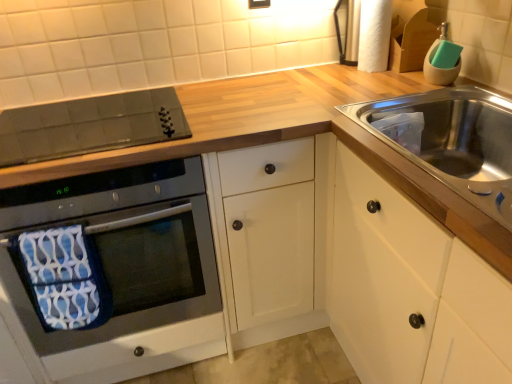
Question: From a real-world perspective, is black glass cooktop at upper left over black glass oven at left?

Choices:
 (A) no
 (B) yes

Answer: (B)

Question: Does black glass cooktop at upper left appear on the left side of black glass oven at left?

Choices:
 (A) no
 (B) yes

Answer: (B)

Question: Is black glass cooktop at upper left positioned behind black glass oven at left?

Choices:
 (A) no
 (B) yes

Answer: (B)

Question: Considering the relative sizes of black glass cooktop at upper left and black glass oven at left in the image provided, is black glass cooktop at upper left shorter than black glass oven at left?

Choices:
 (A) yes
 (B) no

Answer: (A)

Question: Is black glass oven at left located within black glass cooktop at upper left?

Choices:
 (A) no
 (B) yes

Answer: (A)

Question: Is matte black electric outlet at upper center taller or shorter than white textured toilet paper at upper right?

Choices:
 (A) short
 (B) tall

Answer: (A)

Question: From a real-world perspective, relative to white textured toilet paper at upper right, is matte black electric outlet at upper center vertically above or below?

Choices:
 (A) above
 (B) below

Answer: (A)

Question: Is matte black electric outlet at upper center bigger or smaller than white textured toilet paper at upper right?

Choices:
 (A) small
 (B) big

Answer: (A)

Question: Which is correct: matte black electric outlet at upper center is inside white textured toilet paper at upper right, or outside of it?

Choices:
 (A) inside
 (B) outside

Answer: (B)

Question: Looking at their shapes, would you say matte black electric outlet at upper center is wider or thinner than black glass cooktop at upper left?

Choices:
 (A) wide
 (B) thin

Answer: (B)

Question: Which is correct: matte black electric outlet at upper center is inside black glass cooktop at upper left, or outside of it?

Choices:
 (A) outside
 (B) inside

Answer: (A)

Question: From the image's perspective, is matte black electric outlet at upper center above or below black glass cooktop at upper left?

Choices:
 (A) above
 (B) below

Answer: (A)

Question: Considering the relative positions of matte black electric outlet at upper center and black glass cooktop at upper left in the image provided, is matte black electric outlet at upper center to the left or to the right of black glass cooktop at upper left?

Choices:
 (A) left
 (B) right

Answer: (B)

Question: From the image's perspective, is white textured toilet paper at upper right above or below black glass oven at left?

Choices:
 (A) below
 (B) above

Answer: (B)

Question: Looking at their shapes, would you say white textured toilet paper at upper right is wider or thinner than black glass oven at left?

Choices:
 (A) wide
 (B) thin

Answer: (B)